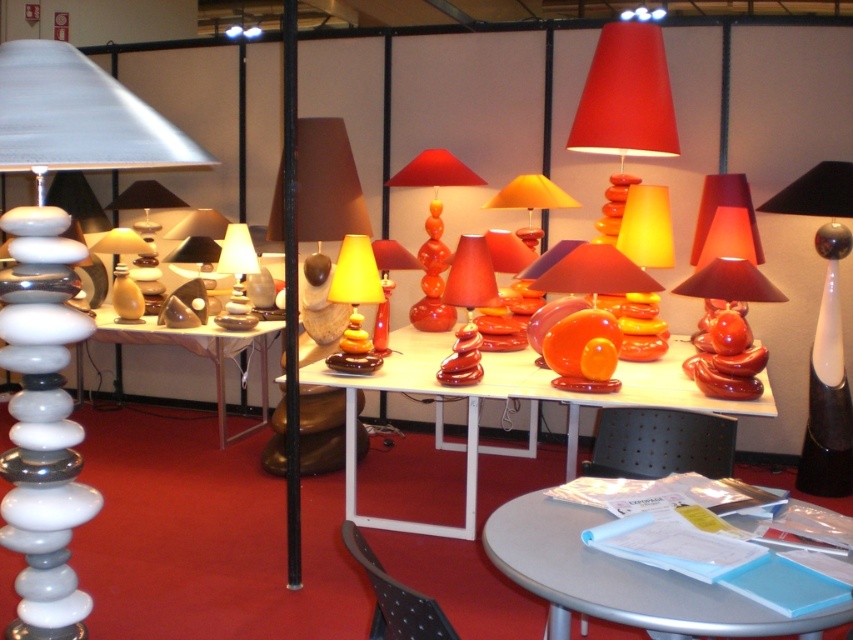
What are the coordinates of the shiny metallic lampshade at center?

The coordinates of the shiny metallic lampshade at center are at point (x=824, y=330).

Consider the image. You are an interior designer assessing the lamps in the showroom. You need to choose a lampshade that is wider for a narrow hallway. Which lampshade between the shiny metallic lampshade at center and the matte white lampshade at center should you select?

The shiny metallic lampshade at center is wider than the matte white lampshade at center, so it would be the better choice for a narrow hallway as it can spread light more broadly.